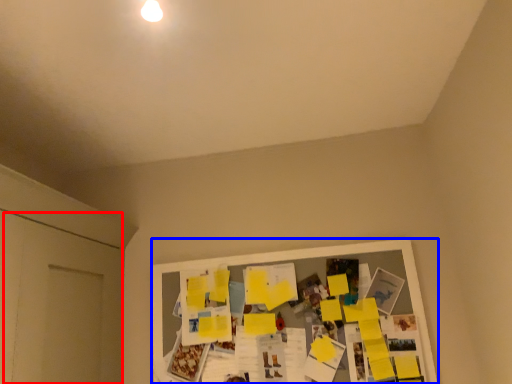
Question: Among these objects, which one is farthest to the camera, door (highlighted by a red box) or bulletin board (highlighted by a blue box)?

Choices:
 (A) door
 (B) bulletin board

Answer: (B)